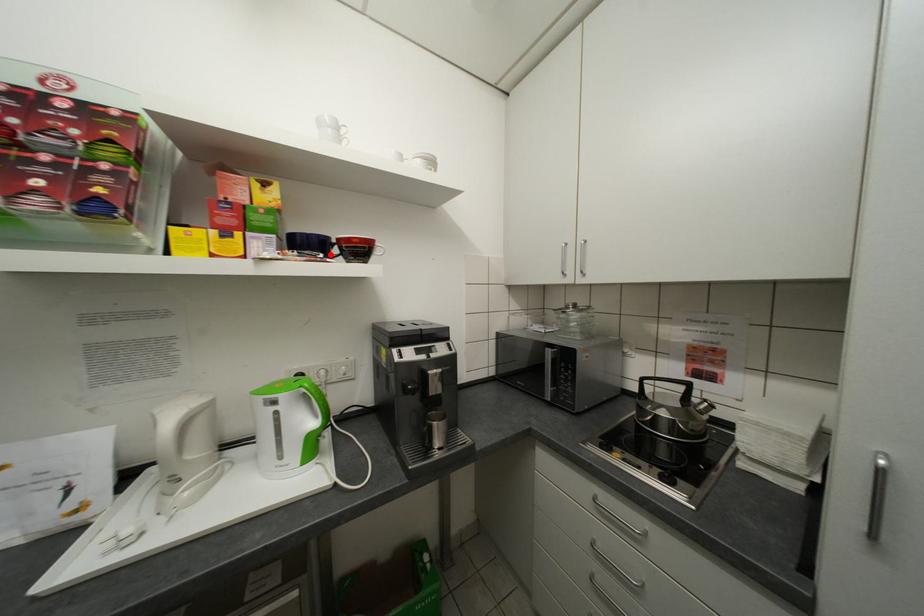
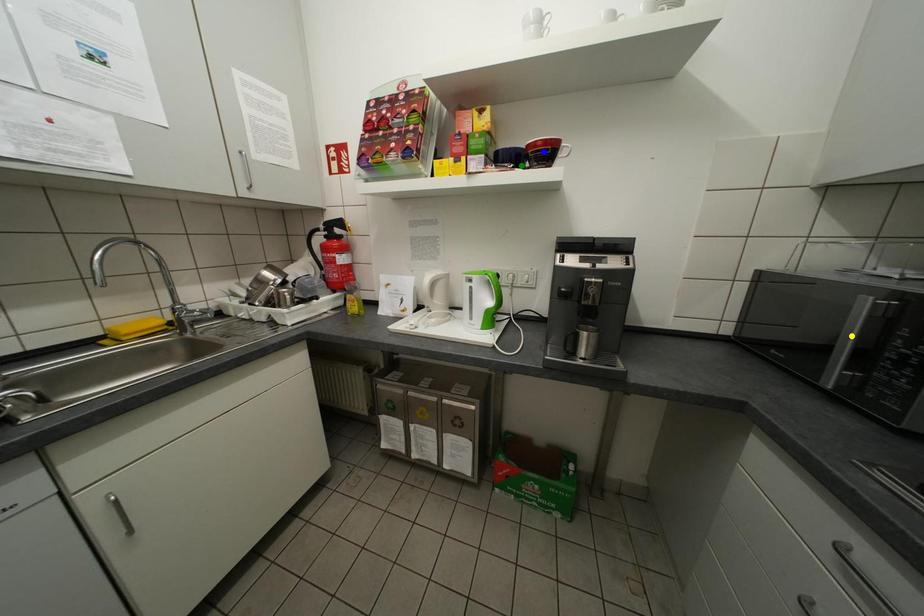
Question: I am providing you with two images of the same scene from different viewpoints. A red point is marked on the first image. You are given multiple points on the second image. Which point in image 2 is actually the same real-world point as the red point in image 1?

Choices:
 (A) blue point
 (B) yellow point
 (C) green point

Answer: (C)